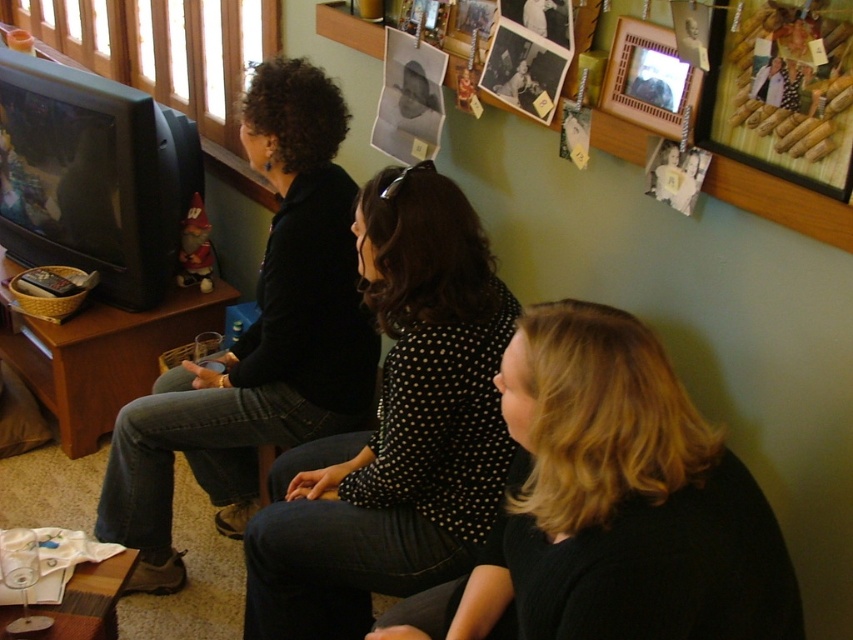
You are a photographer setting up a shoot in this living room. You need to position a light source to the right of both the black dotted shirt at center and the black matte shirt at left. Is this possible given their current arrangement?

The black dotted shirt at center is already to the right of the black matte shirt at left. Therefore, placing a light source to the right of both would require positioning it further to the right of the black dotted shirt at center, which is possible as long as there is space available in that direction.

You are a photographer standing 1.5 meters away from the black dotted shirt at center. You want to take a photo of the shirt using a camera that has a minimum focusing distance of 1.6 meters. Can you take a clear photo without moving closer?

The black dotted shirt at center and camera are 1.60 meters apart from each other. Since the minimum focusing distance of the camera is 1.6 meters, you can just barely take a clear photo without moving closer.

You are a photographer trying to capture a candid shot of the black matte shirt at left and the wooden picture frame at upper right. Since you want both subjects in focus, you need to know their positions relative to each other. Which object is positioned more to the left side of the frame?

The black matte shirt at left is positioned more to the left side of the frame than the wooden picture frame at upper right.